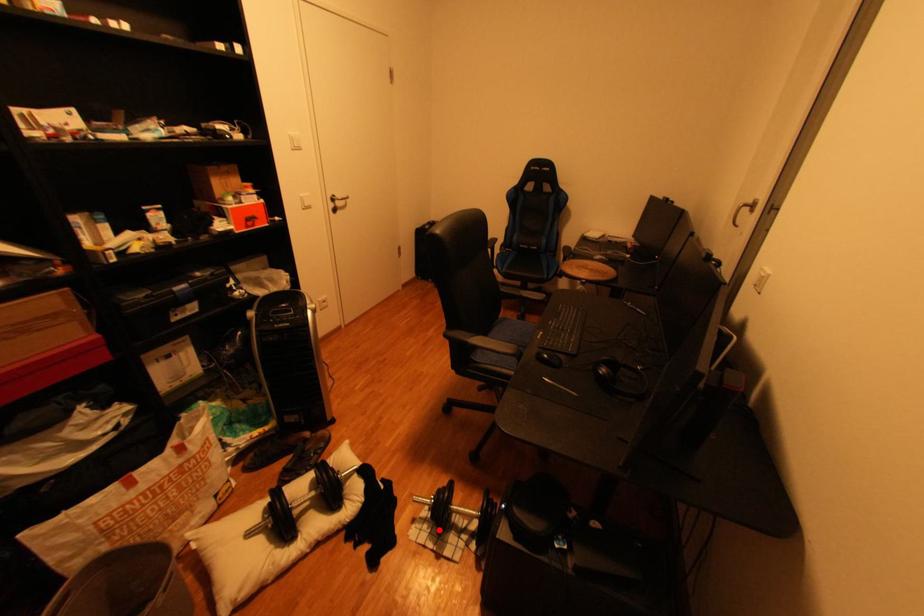
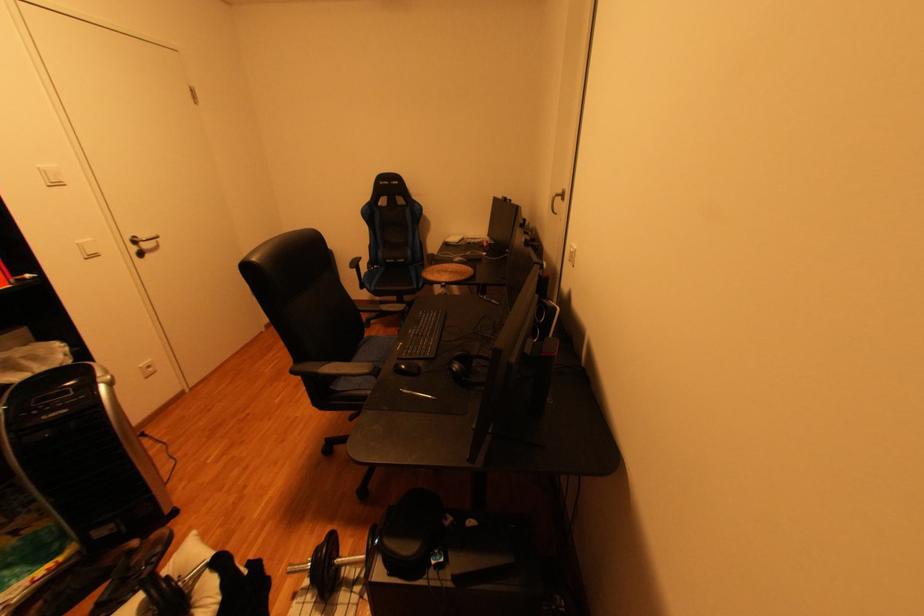
Question: I am providing you with two images of the same scene from different viewpoints. A red point is marked on the first image. At the location where the point appears in image 1, is it still visible in image 2?

Choices:
 (A) Yes
 (B) No

Answer: (A)